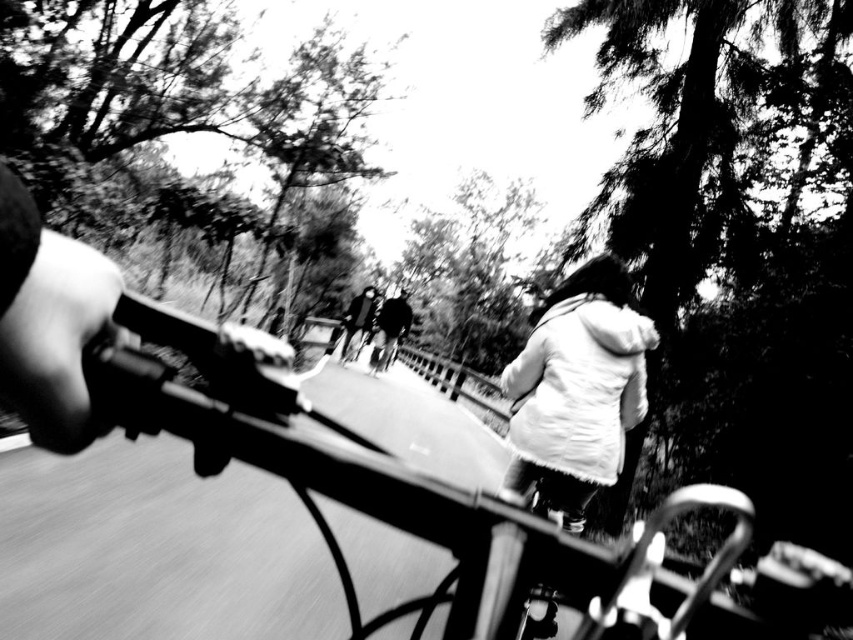
Question: Can you confirm if dark fabric jacket at center is thinner than dark gray fabric jacket at center?

Choices:
 (A) yes
 (B) no

Answer: (B)

Question: Among these points, which one is nearest to the camera?

Choices:
 (A) (354, 316)
 (B) (370, 296)

Answer: (B)

Question: Which object is the closest to the shiny black helmet at center?

Choices:
 (A) white fluffy coat at center
 (B) dark fabric jacket at center

Answer: (B)

Question: Estimate the real-world distances between objects in this image. Which object is closer to the dark gray fabric jacket at center?

Choices:
 (A) dark fabric jacket at center
 (B) white fluffy coat at center

Answer: (A)

Question: Does white fluffy coat at center have a greater width compared to dark gray fabric jacket at center?

Choices:
 (A) yes
 (B) no

Answer: (B)

Question: Does white fluffy coat at center appear over dark gray fabric jacket at center?

Choices:
 (A) yes
 (B) no

Answer: (A)